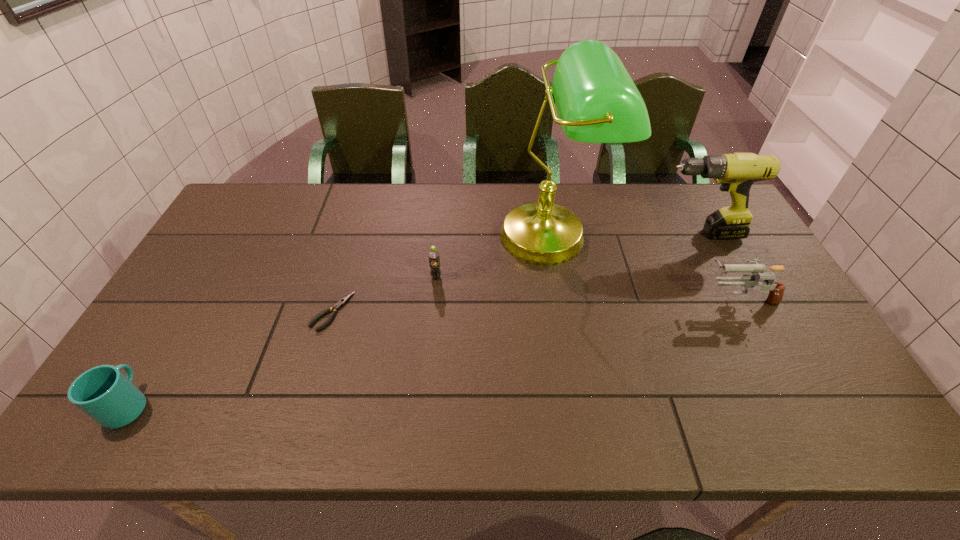
Locate an element on the screen. The width and height of the screenshot is (960, 540). blank space located on the right of the second object from left to right is located at coordinates (423, 312).

Image resolution: width=960 pixels, height=540 pixels. Identify the location of object located in the far edge section of the desktop. (597, 101).

What are the coordinates of `object that is at the near edge` in the screenshot? It's located at (104, 393).

Where is `object at the left edge`? The height and width of the screenshot is (540, 960). object at the left edge is located at coordinates coord(104,393).

I want to click on drill that is at the right edge, so 736,172.

At what (x,y) coordinates should I click in order to perform the action: click on gun situated at the right edge. Please return your answer as a coordinate pair (x, y). The image size is (960, 540). Looking at the image, I should click on (776, 289).

Where is `object located in the near left corner section of the desktop`? This screenshot has height=540, width=960. object located in the near left corner section of the desktop is located at coordinates (104, 393).

This screenshot has height=540, width=960. In order to click on vacant point at the far edge in this screenshot , I will do `click(349, 212)`.

Find the location of `blank space at the near edge of the desktop`. blank space at the near edge of the desktop is located at coordinates (686, 418).

Find the location of `free space at the left edge of the desktop`. free space at the left edge of the desktop is located at coordinates click(221, 292).